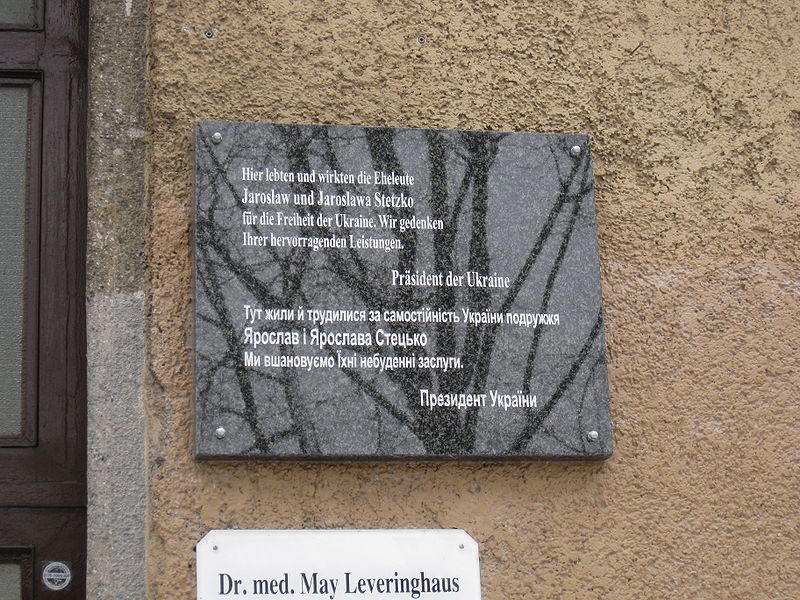
The height and width of the screenshot is (600, 800). What are the coordinates of `white plaque` in the screenshot? It's located at coord(388,548).